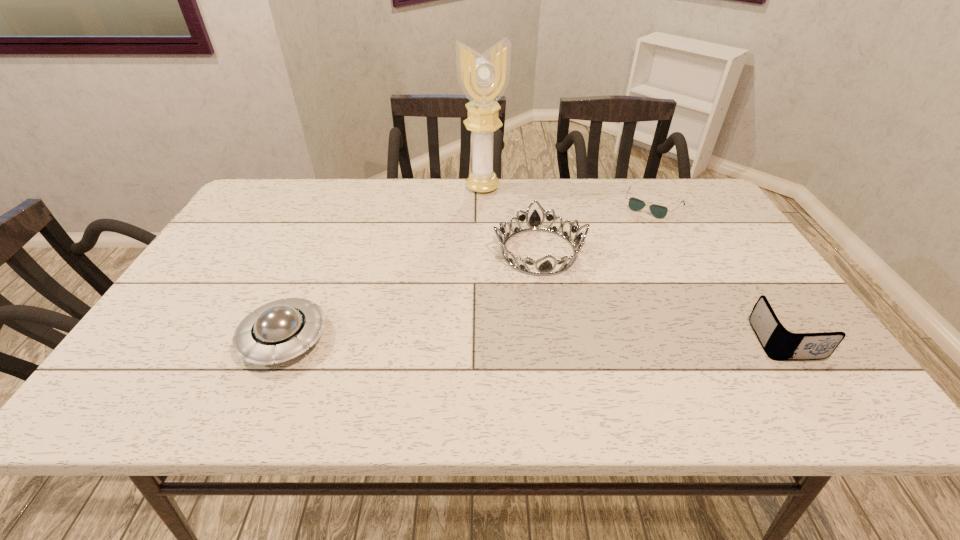
Find the location of `empty space that is in between the tallest object and the wallet`. empty space that is in between the tallest object and the wallet is located at coordinates (634, 264).

The height and width of the screenshot is (540, 960). In order to click on vacant point located between the wallet and the award in this screenshot , I will do `click(634, 264)`.

At what (x,y) coordinates should I click in order to perform the action: click on unoccupied position between the saucer and the tallest object. Please return your answer as a coordinate pair (x, y). Looking at the image, I should click on (384, 263).

The image size is (960, 540). I want to click on vacant area that lies between the wallet and the sunglasses, so click(x=718, y=273).

Find the location of a particular element. vacant space that is in between the tallest object and the shortest object is located at coordinates (567, 196).

At what (x,y) coordinates should I click in order to perform the action: click on free space between the third nearest object and the saucer. Please return your answer as a coordinate pair (x, y). Looking at the image, I should click on (412, 295).

Locate an element on the screen. unoccupied position between the tallest object and the leftmost object is located at coordinates (384, 263).

The width and height of the screenshot is (960, 540). I want to click on vacant area between the shortest object and the wallet, so click(718, 273).

What are the coordinates of `free space between the wallet and the tallest object` in the screenshot? It's located at (634, 264).

I want to click on vacant space that's between the sunglasses and the saucer, so pos(468,272).